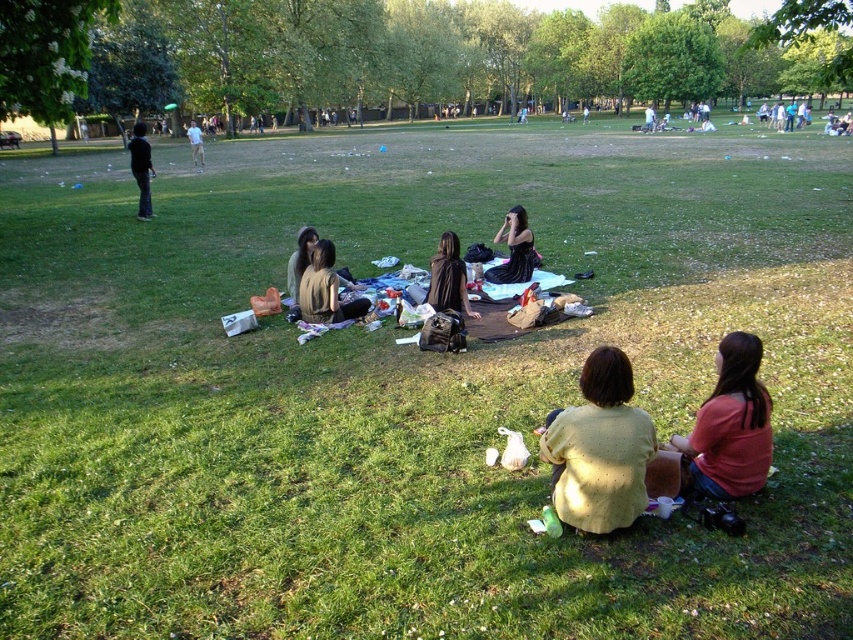
Question: Which object is the closest to the matte brown vest at center?

Choices:
 (A) pink fabric at lower right
 (B) matte brown shirt at center
 (C) light yellow knit sweater at lower center
 (D) dark blue jeans at left

Answer: (B)

Question: Is pink fabric at lower right below dark blue jeans at left?

Choices:
 (A) yes
 (B) no

Answer: (A)

Question: Can you confirm if light yellow knit sweater at lower center is bigger than matte brown shirt at center?

Choices:
 (A) no
 (B) yes

Answer: (A)

Question: Which point is farther to the camera?

Choices:
 (A) matte brown vest at center
 (B) dark blue jeans at left
 (C) pink fabric at lower right

Answer: (B)

Question: Which point appears closest to the camera in this image?

Choices:
 (A) (526, 237)
 (B) (138, 188)
 (C) (198, 164)

Answer: (A)

Question: Is the position of pink fabric at lower right more distant than that of black satin dress at center?

Choices:
 (A) no
 (B) yes

Answer: (A)